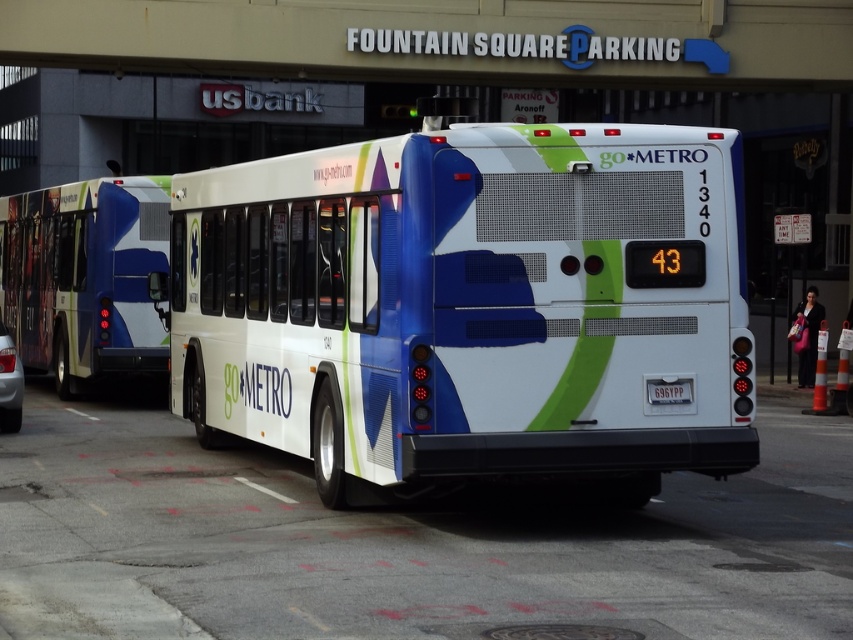
You are a photographer trying to capture the entire matte blue bus at left and the black plastic license plate at center in a single frame. Given their sizes, will the bus be wider than the license plate in your photo?

The matte blue bus at left is wider than the black plastic license plate at center, so yes, the bus will appear wider than the license plate in the photo.

You are standing in front of the go METRO bus and want to determine the distance between two points on the bus. The first point is at coordinates point (54, 211) and the second point is at coordinates point (685, 394). Which point is closer to you?

Point (54, 211) is further to the viewer than point (685, 394). Therefore, the point closer to you is point (685, 394).

You are a pedestrian standing at the crosswalk and see the white glossy bus at center and the matte blue bus at left. Which bus is closer to you?

The white glossy bus at center is closer to you because it is located below the matte blue bus at left, indicating it is in a lower position which typically means it is nearer in such scenes.